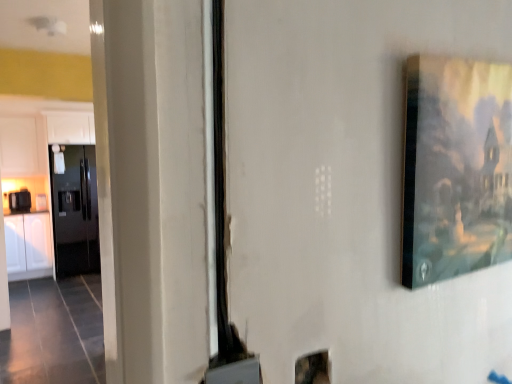
Question: Choose the correct answer: Is glossy black refrigerator at left inside white glossy cabinet at left, the 1th cabinetry from the bottom, or outside it?

Choices:
 (A) inside
 (B) outside

Answer: (B)

Question: Considering their positions, is glossy black refrigerator at left located in front of or behind white glossy cabinet at left, the 1th cabinetry from the bottom?

Choices:
 (A) front
 (B) behind

Answer: (B)

Question: Which of these objects is positioned farthest from the black glossy toaster at left?

Choices:
 (A) matte wooden picture frame at upper right
 (B) white matte cabinet at upper left, acting as the second cabinetry starting from the bottom
 (C) white glossy cabinet at left, the 1th cabinetry from the bottom
 (D) glossy black refrigerator at left

Answer: (A)

Question: Which is nearer to the glossy black refrigerator at left?

Choices:
 (A) black glossy toaster at left
 (B) matte wooden picture frame at upper right
 (C) white glossy cabinet at left, the 1th cabinetry from the bottom
 (D) white matte cabinet at upper left, which ranks as the 1th cabinetry in top-to-bottom order

Answer: (C)